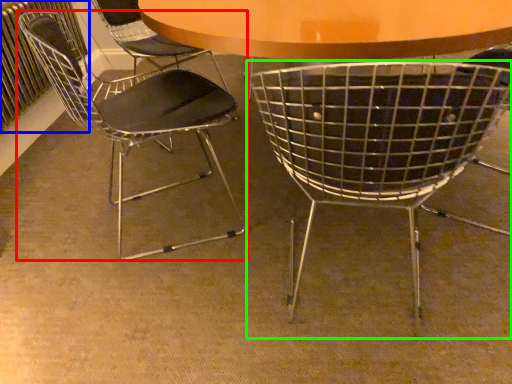
Question: Considering the real-world distances, which object is closest to chair (highlighted by a red box)? radiator (highlighted by a blue box) or chair (highlighted by a green box).

Choices:
 (A) radiator
 (B) chair

Answer: (A)